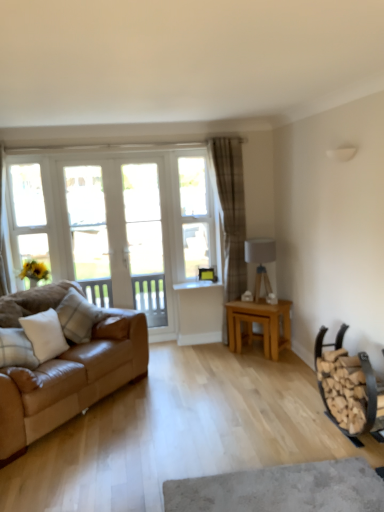
Question: Choose the correct answer: Is clear glass screen door at center, which is the second screen door in left-to-right order, inside brown plaid curtain at center or outside it?

Choices:
 (A) inside
 (B) outside

Answer: (B)

Question: Visually, is clear glass screen door at center, which is the second screen door in left-to-right order, positioned to the left or to the right of brown plaid curtain at center?

Choices:
 (A) right
 (B) left

Answer: (B)

Question: Which is farther from the white painted wood window frame at left?

Choices:
 (A) wooden firewood rack at lower right
 (B) white glossy screen door at left, the 1th screen door in the left-to-right sequence
 (C) light brown wooden table at center
 (D) white cotton pillow at left, which ranks as the second pillow in back-to-front order
 (E) clear glass window at center

Answer: (A)

Question: Which object is the closest to the light brown wooden table at center?

Choices:
 (A) white cotton pillow at left, the 1th pillow when ordered from front to back
 (B) wooden firewood rack at lower right
 (C) clear glass window at center
 (D) matte gray fabric at center-right
 (E) white painted wood window frame at left

Answer: (D)